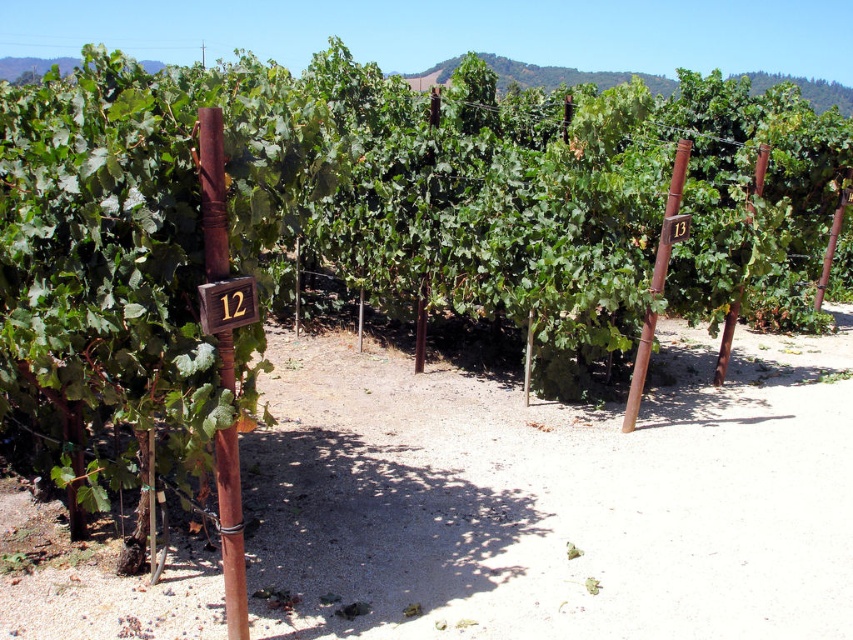
Does rustic wood pole at center-right appear on the left side of rustic wood pole at right?

Correct, you'll find rustic wood pole at center-right to the left of rustic wood pole at right.

Between rustic wood pole at center-right and rustic wood pole at right, which one has more height?

rustic wood pole at right

This screenshot has height=640, width=853. I want to click on rustic wood pole at center-right, so (x=724, y=342).

Locate an element on the screen. The image size is (853, 640). rustic wood pole at center-right is located at coordinates (724, 342).

Is wooden sign at center positioned at the back of rustic wood pole at right?

No, it is in front of rustic wood pole at right.

Looking at this image, between wooden sign at center and rustic wood pole at right, which one is positioned higher?

rustic wood pole at right is above.

Between point (248, 284) and point (830, 228), which one is positioned in front?

Positioned in front is point (248, 284).

Where is `wooden sign at center`? wooden sign at center is located at coordinates (227, 304).

Between rusty wood pole at center right and rustic wood pole at center-right, which one appears on the left side from the viewer's perspective?

rusty wood pole at center right

Which is behind, point (674, 188) or point (717, 369)?

Positioned behind is point (717, 369).

Which is in front, point (682, 161) or point (763, 150)?

Point (682, 161) is in front.

This screenshot has width=853, height=640. What are the coordinates of `rusty wood pole at center right` in the screenshot? It's located at (670, 212).